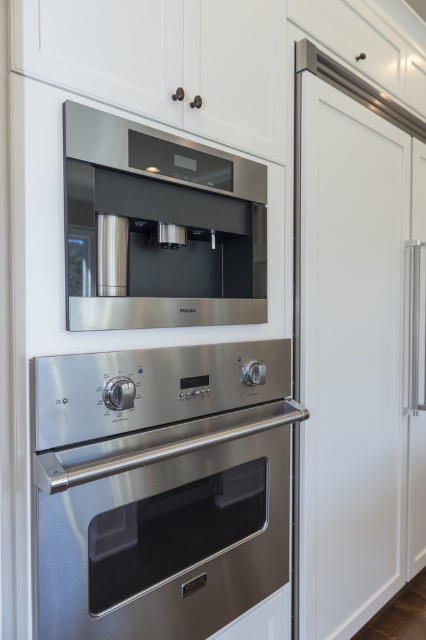
Question: Which point appears farthest from the camera in this image?

Choices:
 (A) (97, 140)
 (B) (78, 528)

Answer: (A)

Question: Is stainless steel coffee machine at upper center thinner than stainless steel exhaust hood at upper center?

Choices:
 (A) no
 (B) yes

Answer: (A)

Question: Which point appears farthest from the camera in this image?

Choices:
 (A) (192, 141)
 (B) (94, 316)

Answer: (A)

Question: Can you confirm if stainless steel oven at lower center is wider than stainless steel exhaust hood at upper center?

Choices:
 (A) no
 (B) yes

Answer: (B)

Question: Which object appears closest to the camera in this image?

Choices:
 (A) stainless steel exhaust hood at upper center
 (B) stainless steel coffee machine at upper center

Answer: (B)

Question: Is stainless steel oven at lower center positioned before stainless steel exhaust hood at upper center?

Choices:
 (A) yes
 (B) no

Answer: (A)